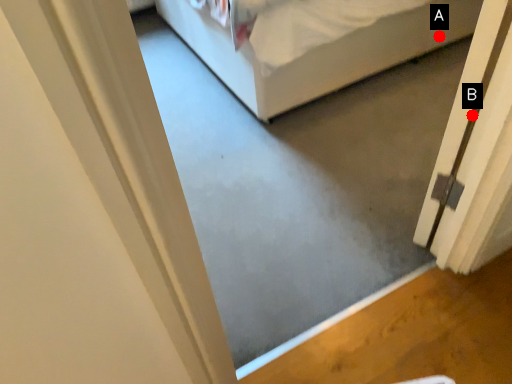
Question: Two points are circled on the image, labeled by A and B beside each circle. Which point is closer to the camera taking this photo?

Choices:
 (A) A is closer
 (B) B is closer

Answer: (B)